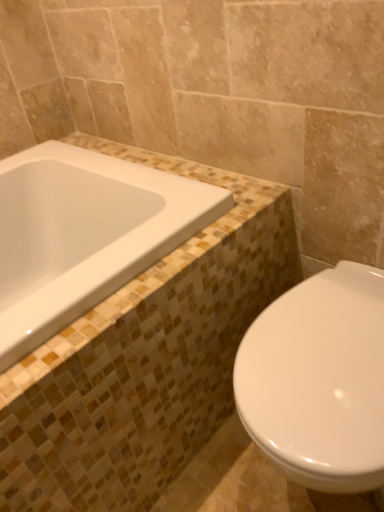
In order to face white glossy bathtub at upper left, should I rotate leftwards or rightwards?

You should rotate left by 17.138 degrees.

You are a GUI agent. You are given a task and a screenshot of the screen. Output one action in this format:
    pyautogui.click(x=<x>, y=<y>)
    Task: Click on the white glossy bathtub at upper left
    
    Given the screenshot: What is the action you would take?
    pyautogui.click(x=84, y=234)

What do you see at coordinates (84, 234) in the screenshot?
I see `white glossy bathtub at upper left` at bounding box center [84, 234].

What is the approximate width of white glossy toilet at lower right?

It is 21.97 inches.

Measure the distance between white glossy toilet at lower right and camera.

Result: The depth of white glossy toilet at lower right is 25.31 inches.

Describe the element at coordinates (319, 380) in the screenshot. I see `white glossy toilet at lower right` at that location.

Identify the location of white glossy toilet at lower right. The image size is (384, 512). (319, 380).

What are the coordinates of `white glossy bathtub at upper left` in the screenshot? It's located at (84, 234).

Visually, is white glossy toilet at lower right positioned to the left or to the right of white glossy bathtub at upper left?

Clearly, white glossy toilet at lower right is on the right of white glossy bathtub at upper left in the image.

Consider the image. Considering the positions of objects white glossy toilet at lower right and white glossy bathtub at upper left in the image provided, who is behind, white glossy toilet at lower right or white glossy bathtub at upper left?

white glossy bathtub at upper left is behind.

Between point (364, 281) and point (47, 289), which one is positioned behind?

The point (364, 281) is farther.

From the image's perspective, would you say white glossy toilet at lower right is positioned over white glossy bathtub at upper left?

No, from the image's perspective, white glossy toilet at lower right is not above white glossy bathtub at upper left.

From a real-world perspective, is white glossy toilet at lower right beneath white glossy bathtub at upper left?

Yes, from a real-world perspective, white glossy toilet at lower right is beneath white glossy bathtub at upper left.

Between white glossy toilet at lower right and white glossy bathtub at upper left, which one has smaller width?

white glossy toilet at lower right.

Does white glossy toilet at lower right have a greater height compared to white glossy bathtub at upper left?

Indeed, white glossy toilet at lower right has a greater height compared to white glossy bathtub at upper left.

In terms of size, does white glossy toilet at lower right appear bigger or smaller than white glossy bathtub at upper left?

Clearly, white glossy toilet at lower right is larger in size than white glossy bathtub at upper left.

Is white glossy toilet at lower right not within white glossy bathtub at upper left?

Absolutely, white glossy toilet at lower right is external to white glossy bathtub at upper left.

Are white glossy toilet at lower right and white glossy bathtub at upper left making contact?

No.

Looking at this image, is white glossy toilet at lower right looking in the opposite direction of white glossy bathtub at upper left?

white glossy toilet at lower right does not have its back to white glossy bathtub at upper left.

What's the angular difference between white glossy toilet at lower right and white glossy bathtub at upper left's facing directions?

89.8 degrees separate the facing orientations of white glossy toilet at lower right and white glossy bathtub at upper left.

Find the location of a particular element. This screenshot has width=384, height=512. bathtub located behind the white glossy toilet at lower right is located at coordinates (84, 234).

Is white glossy bathtub at upper left at the left side of white glossy toilet at lower right?

Yes.

Is white glossy bathtub at upper left in front of white glossy toilet at lower right?

No, it is behind white glossy toilet at lower right.

Is point (126, 254) in front of point (358, 337)?

No, (126, 254) is further to viewer.

From the image's perspective, which one is positioned lower, white glossy bathtub at upper left or white glossy toilet at lower right?

white glossy toilet at lower right is shown below in the image.

From a real-world perspective, is white glossy bathtub at upper left above or below white glossy toilet at lower right?

In terms of real-world spatial position, white glossy bathtub at upper left is above white glossy toilet at lower right.

Between white glossy bathtub at upper left and white glossy toilet at lower right, which one has smaller width?

white glossy toilet at lower right is thinner.

Is white glossy bathtub at upper left taller than white glossy toilet at lower right?

No.

Looking at the image, does white glossy bathtub at upper left seem bigger or smaller compared to white glossy toilet at lower right?

In the image, white glossy bathtub at upper left appears to be smaller than white glossy toilet at lower right.

Is white glossy toilet at lower right completely or partially inside white glossy bathtub at upper left?

That's incorrect, white glossy toilet at lower right is not inside white glossy bathtub at upper left.

In the scene shown: Does white glossy bathtub at upper left touch white glossy toilet at lower right?

white glossy bathtub at upper left and white glossy toilet at lower right are not in contact.

Based on the photo, does white glossy bathtub at upper left turn towards white glossy toilet at lower right?

No, white glossy bathtub at upper left is not turned towards white glossy toilet at lower right.

How different are the orientations of white glossy bathtub at upper left and white glossy toilet at lower right in degrees?

The angle between the facing direction of white glossy bathtub at upper left and the facing direction of white glossy toilet at lower right is 89.8 degrees.

The width and height of the screenshot is (384, 512). I want to click on toilet in front of the white glossy bathtub at upper left, so click(319, 380).

The image size is (384, 512). Find the location of `toilet on the right of white glossy bathtub at upper left`. toilet on the right of white glossy bathtub at upper left is located at coordinates (319, 380).

The image size is (384, 512). Find the location of `bathtub on the left side of white glossy toilet at lower right`. bathtub on the left side of white glossy toilet at lower right is located at coordinates (84, 234).